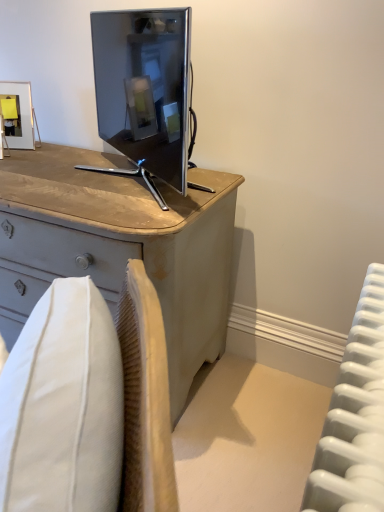
Question: Considering the positions of light gray wood desk at center and white plastic radiator at right in the image, is light gray wood desk at center taller or shorter than white plastic radiator at right?

Choices:
 (A) short
 (B) tall

Answer: (B)

Question: From a real-world perspective, is light gray wood desk at center above or below white plastic radiator at right?

Choices:
 (A) above
 (B) below

Answer: (A)

Question: Estimate the real-world distances between objects in this image. Which object is farther from the metallic gold picture frame at upper left?

Choices:
 (A) light gray wood desk at center
 (B) matte black tv at center
 (C) white plastic radiator at right

Answer: (C)

Question: Estimate the real-world distances between objects in this image. Which object is closer to the matte black tv at center?

Choices:
 (A) light gray wood desk at center
 (B) white plastic radiator at right
 (C) metallic gold picture frame at upper left

Answer: (A)